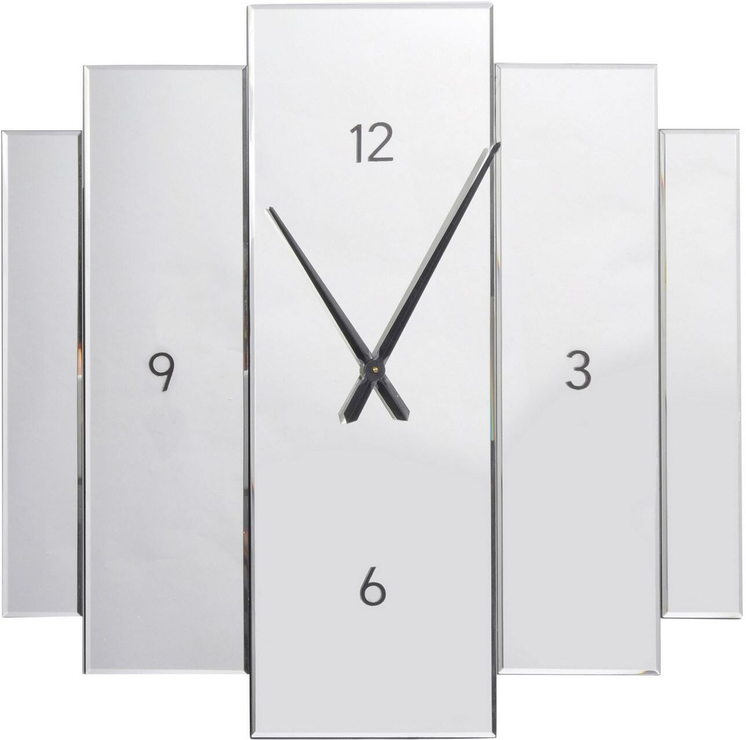
The image size is (746, 740). Identify the location of clock. coord(473,554).